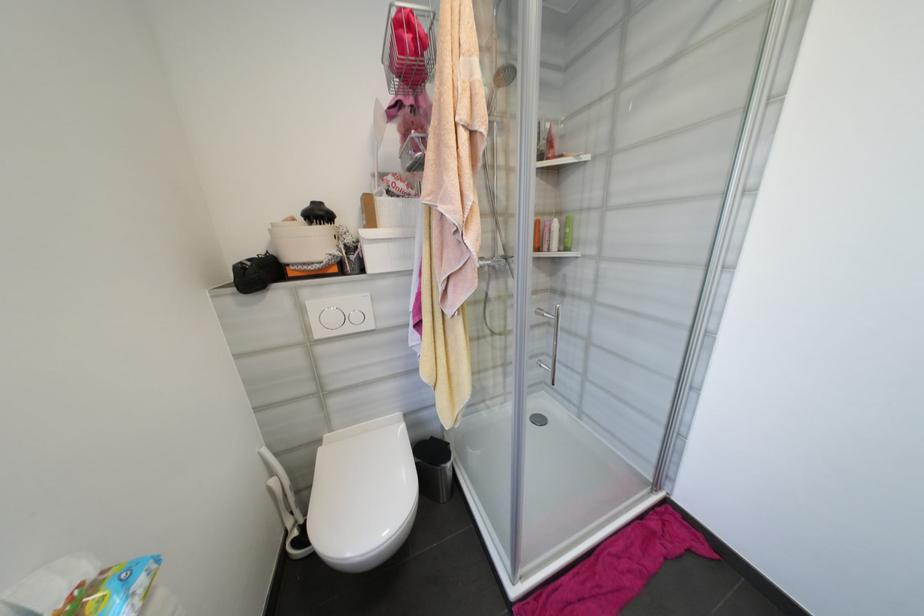
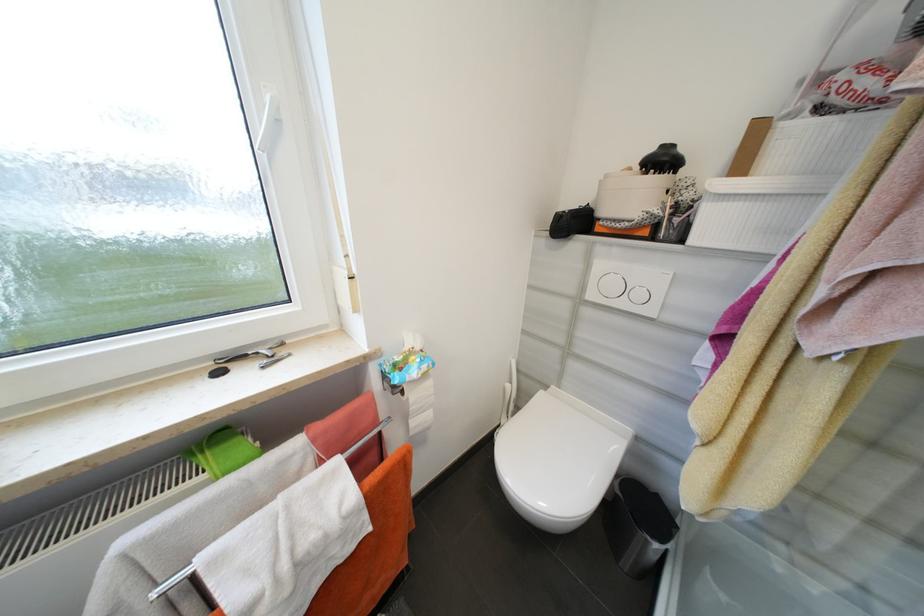
Find the pixel in the second image that matches pixel 361 318 in the first image.

(646, 296)